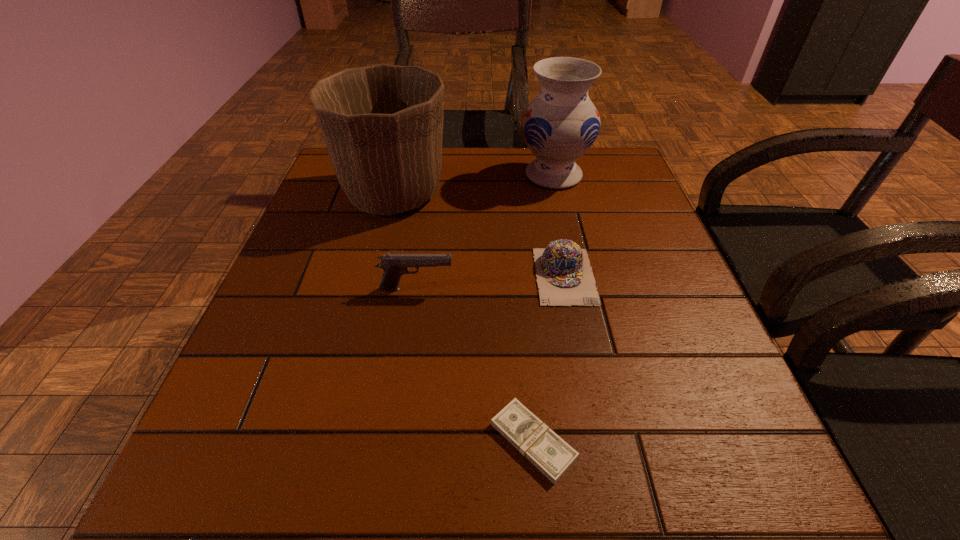
Where is `vacant space located on the left of the nearest object`? vacant space located on the left of the nearest object is located at coordinates (303, 441).

You are a GUI agent. You are given a task and a screenshot of the screen. Output one action in this format:
    pyautogui.click(x=<x>, y=<y>)
    Task: Click on the vase at the far edge
    This screenshot has width=960, height=540.
    Given the screenshot: What is the action you would take?
    pyautogui.click(x=560, y=124)

Where is `flowerpot that is at the far edge`? This screenshot has width=960, height=540. flowerpot that is at the far edge is located at coordinates (383, 124).

Where is `object at the near edge`? object at the near edge is located at coordinates (549, 453).

Identify the location of object that is at the left edge. (383, 124).

Locate an element on the screen. object at the right edge is located at coordinates (560, 124).

I want to click on object present at the far left corner, so click(x=383, y=124).

Where is `object at the far right corner`? The width and height of the screenshot is (960, 540). object at the far right corner is located at coordinates (560, 124).

Identify the location of vacant space at the far edge of the desktop. This screenshot has height=540, width=960. (565, 188).

Image resolution: width=960 pixels, height=540 pixels. In the image, there is a desktop. Find the location of `vacant space at the near edge`. vacant space at the near edge is located at coordinates (616, 469).